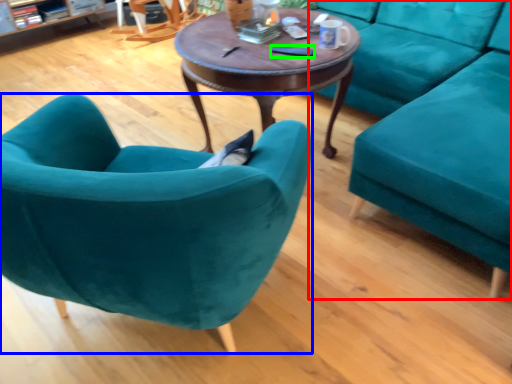
Question: Which is nearer to the studio couch (highlighted by a red box)? chair (highlighted by a blue box) or remote control (highlighted by a green box).

Choices:
 (A) chair
 (B) remote control

Answer: (B)